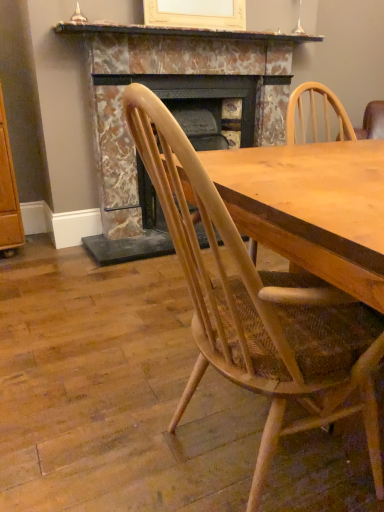
What do you see at coordinates (259, 306) in the screenshot? This screenshot has height=512, width=384. I see `natural wood chair at center` at bounding box center [259, 306].

The image size is (384, 512). What do you see at coordinates (174, 113) in the screenshot? I see `marble fireplace at center` at bounding box center [174, 113].

Locate an element on the screen. marble mantel at upper center is located at coordinates (182, 32).

Based on the photo, relative to marble fireplace at center, is marble mantel at upper center in front or behind?

Visually, marble mantel at upper center is located in front of marble fireplace at center.

The image size is (384, 512). In order to click on mantle that appears on the right of marble fireplace at center in this screenshot , I will do `click(182, 32)`.

Could you tell me if marble mantel at upper center is facing marble fireplace at center?

No, marble mantel at upper center is not turned towards marble fireplace at center.

Between marble mantel at upper center and marble fireplace at center, which one has smaller width?

marble mantel at upper center is thinner.

From a real-world perspective, is natural wood chair at center physically below marble fireplace at center?

Yes, from a real-world perspective, natural wood chair at center is beneath marble fireplace at center.

Based on their sizes in the image, would you say natural wood chair at center is bigger or smaller than marble fireplace at center?

In the image, natural wood chair at center appears to be smaller than marble fireplace at center.

Is natural wood chair at center outside of marble fireplace at center?

Absolutely, natural wood chair at center is external to marble fireplace at center.

How much distance is there between natural wood chair at center and marble fireplace at center?

natural wood chair at center is 1.67 meters away from marble fireplace at center.

In the image, is marble fireplace at center positioned in front of or behind marble mantel at upper center?

marble fireplace at center is positioned farther from the viewer than marble mantel at upper center.

From a real-world perspective, is marble fireplace at center on marble mantel at upper center?

Incorrect, from a real-world perspective, marble fireplace at center is lower than marble mantel at upper center.

Based on their sizes in the image, would you say marble fireplace at center is bigger or smaller than marble mantel at upper center?

In the image, marble fireplace at center appears to be larger than marble mantel at upper center.

From the image's perspective, would you say marble fireplace at center is positioned over marble mantel at upper center?

Incorrect, from the image's perspective, marble fireplace at center is lower than marble mantel at upper center.

Which of these two, marble mantel at upper center or natural wood chair at center, is bigger?

natural wood chair at center.

What are the coordinates of `chair lying in front of the marble mantel at upper center` in the screenshot? It's located at (259, 306).

Is marble mantel at upper center taller than natural wood chair at center?

In fact, marble mantel at upper center may be shorter than natural wood chair at center.

Considering the positions of objects marble mantel at upper center and natural wood chair at center in the image provided, who is in front, marble mantel at upper center or natural wood chair at center?

natural wood chair at center is in front.

In terms of width, does marble fireplace at center look wider or thinner when compared to natural wood chair at center?

Clearly, marble fireplace at center has less width compared to natural wood chair at center.

Is marble fireplace at center outside of natural wood chair at center?

Absolutely, marble fireplace at center is external to natural wood chair at center.

Where is `fireplace above the natural wood chair at center (from the image's perspective)`? fireplace above the natural wood chair at center (from the image's perspective) is located at coordinates (174, 113).

Can you confirm if natural wood chair at center is shorter than marble mantel at upper center?

No, natural wood chair at center is not shorter than marble mantel at upper center.

From the image's perspective, relative to marble mantel at upper center, is natural wood chair at center above or below?

natural wood chair at center is situated lower than marble mantel at upper center in the image.

Between point (374, 424) and point (146, 27), which one is positioned in front?

The point (374, 424) is closer to the camera.

Is natural wood chair at center not within marble mantel at upper center?

Absolutely, natural wood chair at center is external to marble mantel at upper center.

At what (x,y) coordinates should I click in order to perform the action: click on fireplace that is behind the marble mantel at upper center. Please return your answer as a coordinate pair (x, y). Looking at the image, I should click on (174, 113).

This screenshot has height=512, width=384. In order to click on fireplace on the left of natural wood chair at center in this screenshot , I will do `click(174, 113)`.

When comparing their distances from natural wood chair at center, does marble fireplace at center or marble mantel at upper center seem further?

Among the two, marble mantel at upper center is located further to natural wood chair at center.

Estimate the real-world distances between objects in this image. Which object is closer to marble fireplace at center, natural wood chair at center or marble mantel at upper center?

marble mantel at upper center.

From the image, which object appears to be farther from marble mantel at upper center, natural wood chair at center or marble fireplace at center?

natural wood chair at center lies further to marble mantel at upper center than the other object.

Based on their spatial positions, is marble fireplace at center or natural wood chair at center closer to marble mantel at upper center?

marble fireplace at center.

Considering their positions, is marble mantel at upper center positioned further to natural wood chair at center than marble fireplace at center?

The object further to natural wood chair at center is marble mantel at upper center.

Which object lies nearer to the anchor point marble fireplace at center, marble mantel at upper center or natural wood chair at center?

Based on the image, marble mantel at upper center appears to be nearer to marble fireplace at center.

The height and width of the screenshot is (512, 384). In order to click on mantle between natural wood chair at center and marble fireplace at center from front to back in this screenshot , I will do `click(182, 32)`.